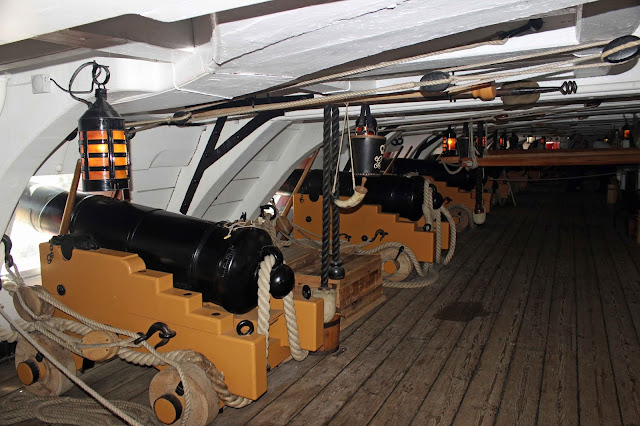
Find the location of `ceiling`. ceiling is located at coordinates (390, 13).